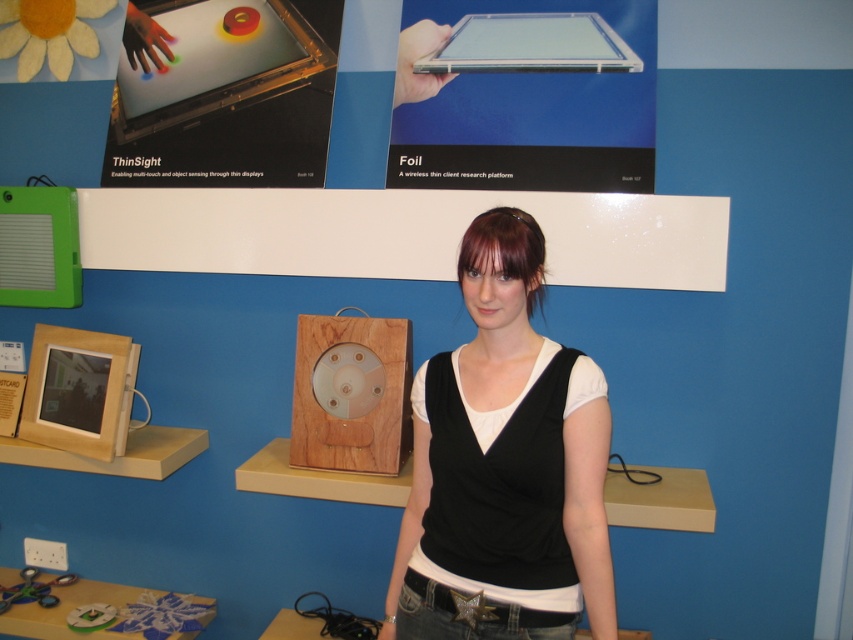
Is black matte tank top at center below wooden clock at center?

Yes, black matte tank top at center is below wooden clock at center.

Is point (548, 454) closer to viewer compared to point (338, 433)?

Yes.

Does point (558, 532) lie in front of point (387, 413)?

Yes.

I want to click on black matte tank top at center, so click(505, 461).